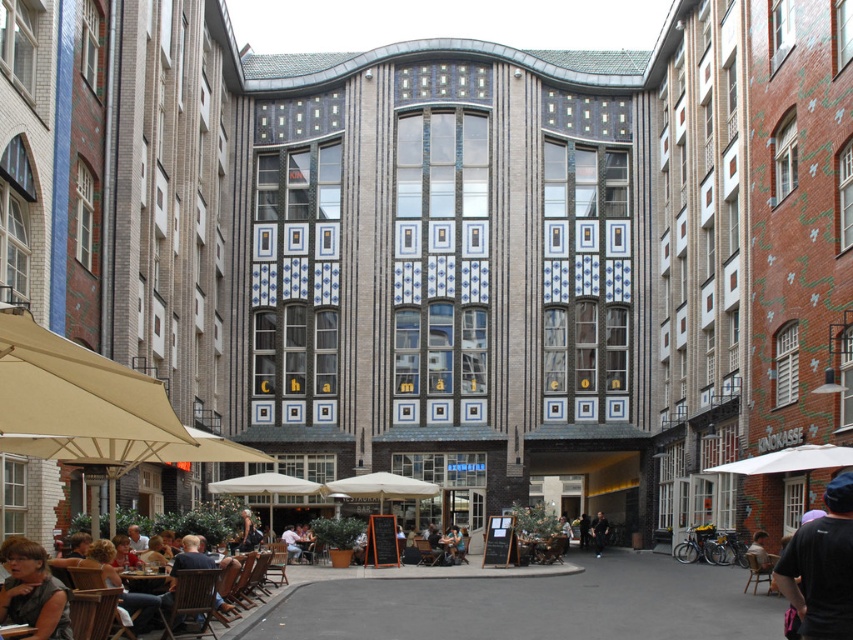
Is dark blue fabric cap at lower right taller than wooden table at center?

Indeed, dark blue fabric cap at lower right has a greater height compared to wooden table at center.

Does dark blue fabric cap at lower right have a lesser width compared to wooden table at center?

No.

Who is more forward, [805,595] or [136,589]?

Point [805,595]

This screenshot has width=853, height=640. I want to click on dark blue fabric cap at lower right, so click(822, 566).

Who is more forward, (24, 563) or (601, 536)?

Positioned in front is point (24, 563).

Is dark gray fabric at lower left to the left of black leather jacket at center from the viewer's perspective?

Correct, you'll find dark gray fabric at lower left to the left of black leather jacket at center.

Does point (50, 618) come farther from viewer compared to point (598, 513)?

No, (50, 618) is in front of (598, 513).

Locate an element on the screen. The width and height of the screenshot is (853, 640). dark gray fabric at lower left is located at coordinates (33, 593).

Does dark blue fabric cap at lower right appear over dark gray fabric at lower left?

Yes.

Who is more forward, (x=788, y=550) or (x=15, y=612)?

Point (x=15, y=612) is in front.

Where is `dark blue fabric cap at lower right`? The width and height of the screenshot is (853, 640). dark blue fabric cap at lower right is located at coordinates (822, 566).

Find the location of `dark blue fabric cap at lower right`. dark blue fabric cap at lower right is located at coordinates (822, 566).